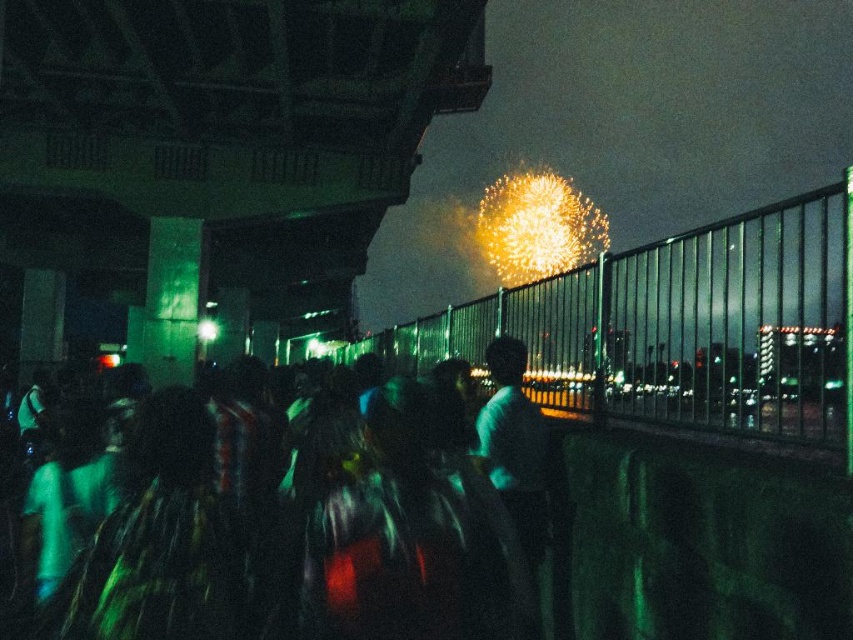
Who is more forward, (751, 339) or (349, 481)?

Point (349, 481)

What do you see at coordinates (676, 326) in the screenshot? I see `metallic fence at upper center` at bounding box center [676, 326].

Which is behind, point (679, 288) or point (490, 605)?

The point (679, 288) is behind.

The width and height of the screenshot is (853, 640). In order to click on metallic fence at upper center in this screenshot , I will do `click(676, 326)`.